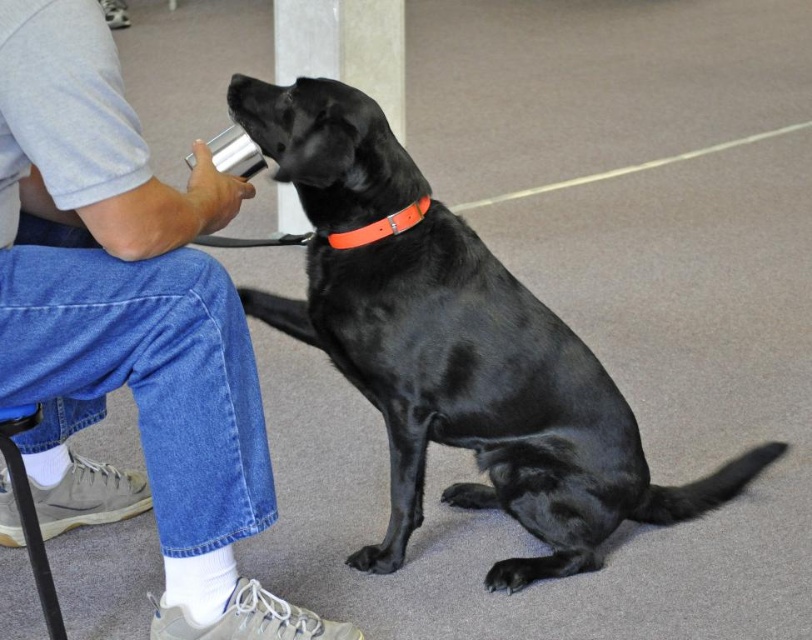
What is located at the coordinate point (128, 326) in the image?

The gray cotton shirt at upper left is located at the coordinate point (128, 326).

You are a dog trainer observing the scene. You need to determine which object takes up more space in the image. Which is larger in size between the gray cotton shirt at upper left and the black smooth dog at center?

The gray cotton shirt at upper left is smaller than the black smooth dog at center, so the black smooth dog at center is larger in size.

You are a photographer standing in the room. You need to capture a photo that includes both the gray cotton shirt at upper left and the black smooth dog at center. Which object should you focus on first to ensure both are in frame?

The gray cotton shirt at upper left has a greater height compared to the black smooth dog at center, so you should focus on the gray cotton shirt at upper left first to ensure both are in frame.